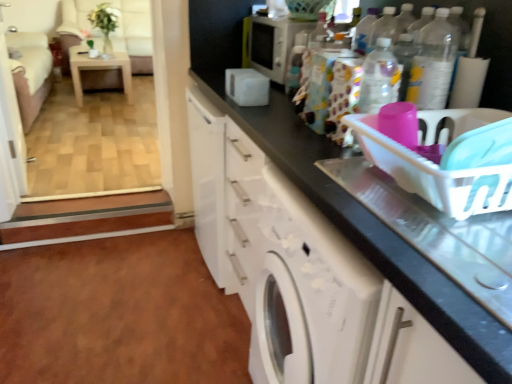
Question: Is white glossy cabinet at lower center smaller than patterned fabric bag at upper center, marked as the first bottle in a back-to-front arrangement?

Choices:
 (A) yes
 (B) no

Answer: (B)

Question: From a real-world perspective, does white glossy cabinet at lower center stand above patterned fabric bag at upper center, marked as the first bottle in a back-to-front arrangement?

Choices:
 (A) yes
 (B) no

Answer: (B)

Question: Considering the relative sizes of white glossy cabinet at lower center and patterned fabric bag at upper center, which is the 2th bottle in front-to-back order, in the image provided, is white glossy cabinet at lower center thinner than patterned fabric bag at upper center, which is the 2th bottle in front-to-back order,?

Choices:
 (A) no
 (B) yes

Answer: (A)

Question: Is patterned fabric bag at upper center, acting as the first bottle starting from the left, inside white glossy cabinet at lower center?

Choices:
 (A) yes
 (B) no

Answer: (B)

Question: Would you say white glossy cabinet at lower center is a long distance from patterned fabric bag at upper center, acting as the 2th bottle starting from the right?

Choices:
 (A) yes
 (B) no

Answer: (B)

Question: In terms of size, does white glossy microwave at upper center appear bigger or smaller than white plastic basket at right?

Choices:
 (A) big
 (B) small

Answer: (A)

Question: Is white glossy microwave at upper center inside or outside of white plastic basket at right?

Choices:
 (A) inside
 (B) outside

Answer: (B)

Question: From the image's perspective, is white glossy microwave at upper center located above or below white plastic basket at right?

Choices:
 (A) below
 (B) above

Answer: (B)

Question: Considering the positions of white glossy microwave at upper center and white plastic basket at right in the image, is white glossy microwave at upper center wider or thinner than white plastic basket at right?

Choices:
 (A) wide
 (B) thin

Answer: (B)

Question: Relative to clear plastic bottle at upper right, marked as the second bottle in a back-to-front arrangement, is white plastic basket at right in front or behind?

Choices:
 (A) behind
 (B) front

Answer: (B)

Question: From the image's perspective, relative to clear plastic bottle at upper right, marked as the 2th bottle in a left-to-right arrangement, is white plastic basket at right above or below?

Choices:
 (A) below
 (B) above

Answer: (A)

Question: Is point (418, 132) closer or farther from the camera than point (457, 29)?

Choices:
 (A) closer
 (B) farther

Answer: (A)

Question: Do you think white plastic basket at right is within clear plastic bottle at upper right, placed as the first bottle when sorted from right to left, or outside of it?

Choices:
 (A) inside
 (B) outside

Answer: (B)

Question: Considering the positions of point (272, 150) and point (10, 119), is point (272, 150) closer or farther from the camera than point (10, 119)?

Choices:
 (A) farther
 (B) closer

Answer: (B)

Question: From the image's perspective, is white glossy cabinet at lower center positioned above or below white glossy screen door at upper left?

Choices:
 (A) below
 (B) above

Answer: (A)